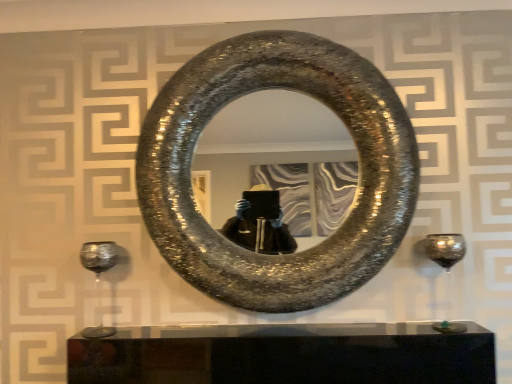
Question: Considering the relative sizes of shiny metallic horseshoe at center and shiny metallic wine glass at lower left, which is the second wine glass from right to left, in the image provided, is shiny metallic horseshoe at center wider than shiny metallic wine glass at lower left, which is the second wine glass from right to left,?

Choices:
 (A) yes
 (B) no

Answer: (A)

Question: Is shiny metallic horseshoe at center surrounding shiny metallic wine glass at lower left, which is the second wine glass from right to left?

Choices:
 (A) yes
 (B) no

Answer: (B)

Question: Is the position of shiny metallic horseshoe at center more distant than that of shiny metallic wine glass at lower left, which is the second wine glass from right to left?

Choices:
 (A) no
 (B) yes

Answer: (A)

Question: Is shiny metallic horseshoe at center not near shiny metallic wine glass at lower left, the 1th wine glass from the left?

Choices:
 (A) yes
 (B) no

Answer: (B)

Question: Considering the relative positions of shiny metallic horseshoe at center and shiny metallic wine glass at lower left, the 1th wine glass from the left, in the image provided, is shiny metallic horseshoe at center to the right of shiny metallic wine glass at lower left, the 1th wine glass from the left, from the viewer's perspective?

Choices:
 (A) no
 (B) yes

Answer: (B)

Question: Is shiny metallic horseshoe at center in front of or behind shiny metallic wine glass at lower left, which is the second wine glass from right to left, in the image?

Choices:
 (A) behind
 (B) front

Answer: (B)

Question: From a real-world perspective, is shiny metallic horseshoe at center above or below shiny metallic wine glass at lower left, the 1th wine glass from the left?

Choices:
 (A) above
 (B) below

Answer: (A)

Question: Does point (301, 286) appear closer or farther from the camera than point (101, 258)?

Choices:
 (A) farther
 (B) closer

Answer: (B)

Question: Looking at their shapes, would you say shiny metallic horseshoe at center is wider or thinner than shiny metallic wine glass at lower left, which is the second wine glass from right to left?

Choices:
 (A) wide
 (B) thin

Answer: (A)

Question: In the image, is transparent glass wine glass at right, the second wine glass positioned from the left, on the left side or the right side of shiny metallic wine glass at lower left, the 1th wine glass from the left?

Choices:
 (A) left
 (B) right

Answer: (B)

Question: Considering the positions of transparent glass wine glass at right, acting as the first wine glass starting from the right, and shiny metallic wine glass at lower left, the 1th wine glass from the left, in the image, is transparent glass wine glass at right, acting as the first wine glass starting from the right, taller or shorter than shiny metallic wine glass at lower left, the 1th wine glass from the left,?

Choices:
 (A) short
 (B) tall

Answer: (B)

Question: Looking at the image, does transparent glass wine glass at right, acting as the first wine glass starting from the right, seem bigger or smaller compared to shiny metallic wine glass at lower left, the 1th wine glass from the left?

Choices:
 (A) big
 (B) small

Answer: (B)

Question: From a real-world perspective, is transparent glass wine glass at right, the second wine glass positioned from the left, positioned above or below shiny metallic wine glass at lower left, which is the second wine glass from right to left?

Choices:
 (A) below
 (B) above

Answer: (A)

Question: Which is correct: shiny metallic horseshoe at center is inside transparent glass wine glass at right, acting as the first wine glass starting from the right, or outside of it?

Choices:
 (A) outside
 (B) inside

Answer: (A)

Question: In the image, is shiny metallic horseshoe at center positioned in front of or behind transparent glass wine glass at right, the second wine glass positioned from the left?

Choices:
 (A) behind
 (B) front

Answer: (B)